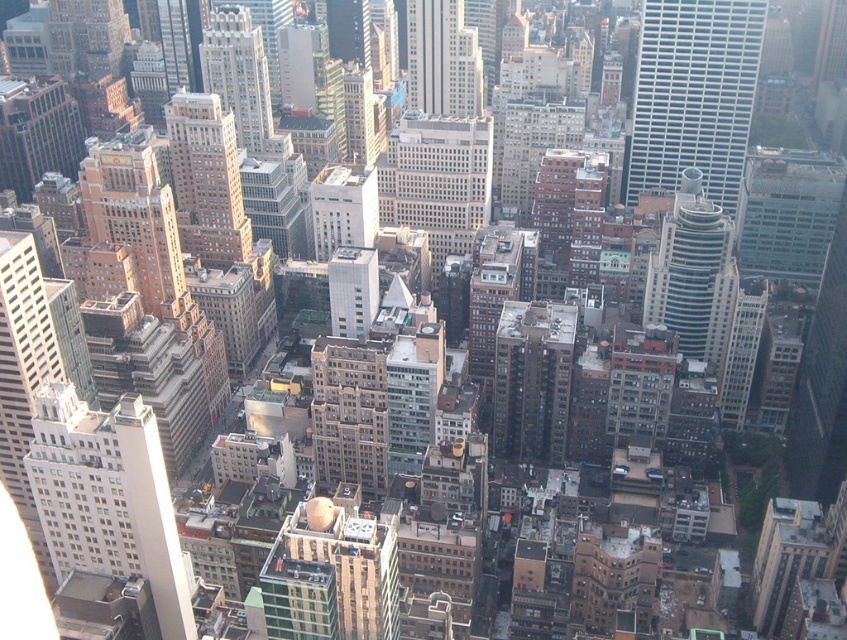
You are an urban planner reviewing an aerial map of a city. You notice a point labeled at coordinates (693, 93). Based on the scene description, what type of building does this point most likely represent?

The point at coordinates (693, 93) corresponds to a white glass skyscraper at upper right, as stated in the objects description.

You are a drone operator tasked with capturing aerial footage of the city. Your drone is currently at the center of the image. You need to fly it to the white glass skyscraper at upper right. What direction should you steer the drone to reach it?

The white glass skyscraper at upper right is located at point coordinates north east of the current position. Since the drone is at the center, you should steer it northeast to reach the white glass skyscraper at upper right.